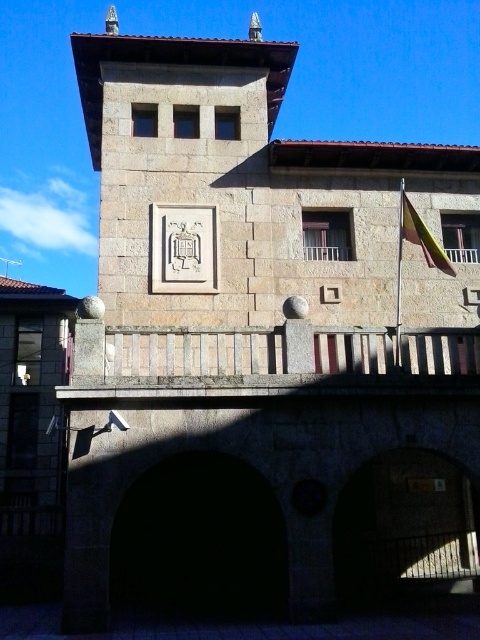
You are standing 10 meters away from the building. You want to reach both the white stone clock at center and the yellow fabric flag at upper right. Which one should you approach first to minimize the total walking distance?

You should approach the white stone clock at center first because it is closer to you than the yellow fabric flag at upper right. Since you are 10 meters away from the building, the distance to the clock is 5.45 meters, while the flag is farther away. By going to the clock first, you reduce the total distance walked compared to starting with the flag.

You are standing in front of the stone building and want to reach both the white stone clock at center and the yellow fabric flag at upper right. Which object will you encounter first as you approach the building?

You will encounter the white stone clock at center first because it is closer to you than the yellow fabric flag at upper right, which is positioned further back.

You are standing in front of the stone building and want to hang a new flag. The current yellow fabric flag at upper right is below the white stone clock at center. Where should you place the new flag to maintain symmetry with the existing flag?

To maintain symmetry, the new flag should be placed at the upper left, mirroring the position of the yellow fabric flag at upper right, which is below the white stone clock at center.